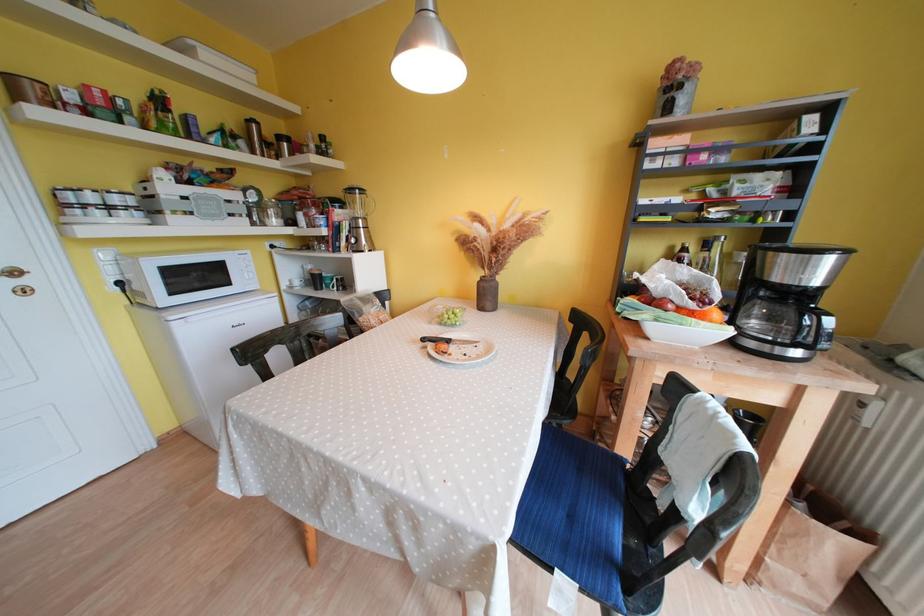
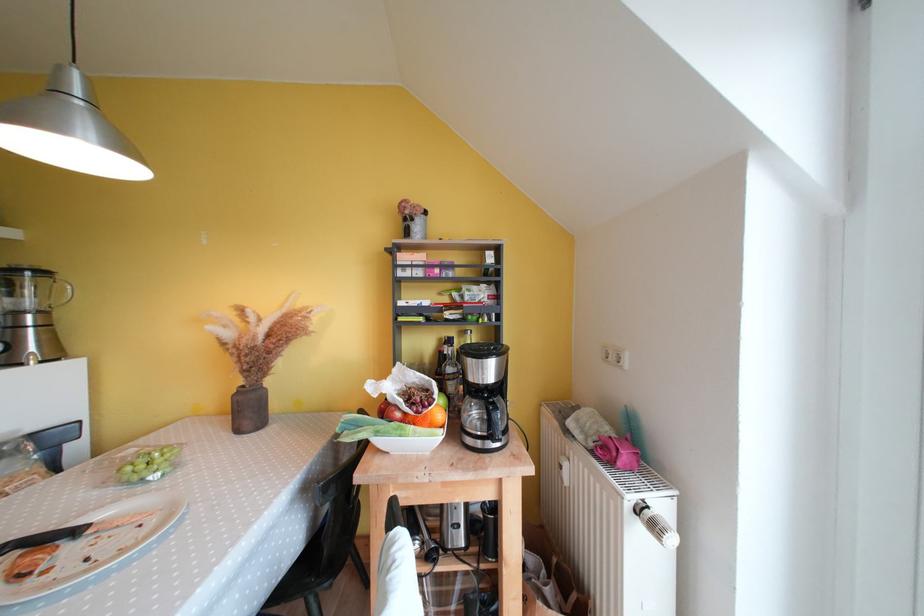
In the second image, find the point that corresponds to [371,223] in the first image.

(49, 315)